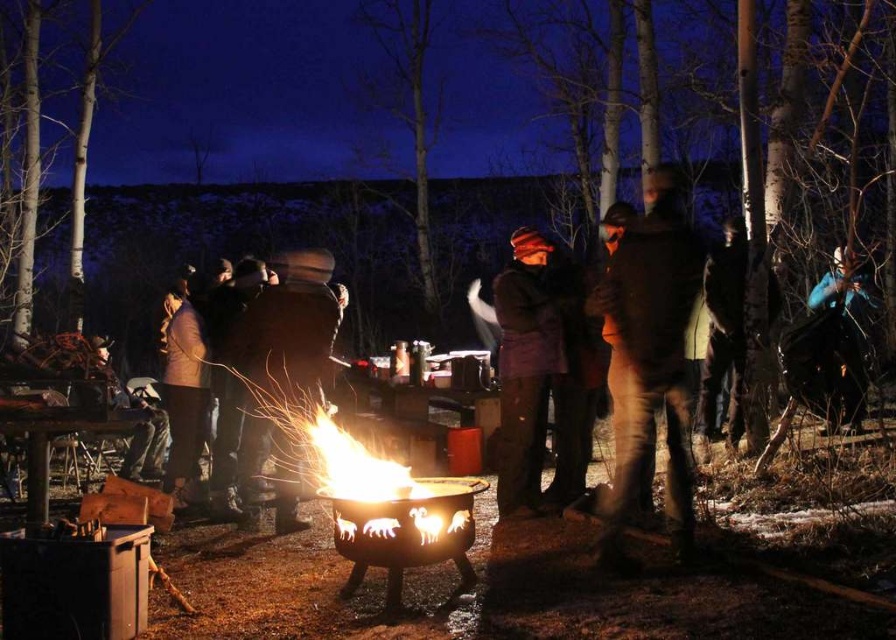
Does dark brown leather jacket at center have a greater width compared to blue fabric jacket at right?

Incorrect, dark brown leather jacket at center's width does not surpass blue fabric jacket at right's.

Is dark brown leather jacket at center above blue fabric jacket at right?

No, dark brown leather jacket at center is not above blue fabric jacket at right.

Between point (240, 353) and point (850, 324), which one is positioned in front?

Point (240, 353) is more forward.

At what (x,y) coordinates should I click in order to perform the action: click on dark brown leather jacket at center. Please return your answer as a coordinate pair (x, y). Looking at the image, I should click on (282, 372).

Does point (674, 467) lie behind point (179, 396)?

No.

Is brown fuzzy jacket at center shorter than light brown leather jacket at center?

No.

Who is more forward, (616, 268) or (183, 464)?

Point (616, 268) is in front.

Image resolution: width=896 pixels, height=640 pixels. Identify the location of brown fuzzy jacket at center. (650, 356).

Looking at this image, is brown fuzzy jacket at center smaller than purple woolen hat at center?

Incorrect, brown fuzzy jacket at center is not smaller in size than purple woolen hat at center.

Who is positioned more to the left, brown fuzzy jacket at center or purple woolen hat at center?

purple woolen hat at center is more to the left.

Is point (688, 243) farther from viewer compared to point (541, 392)?

No, it is in front of (541, 392).

What are the coordinates of `brown fuzzy jacket at center` in the screenshot? It's located at (650, 356).